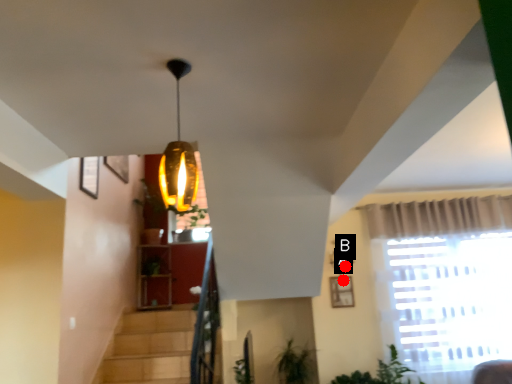
Question: Two points are circled on the image, labeled by A and B beside each circle. Which point is farther to the camera?

Choices:
 (A) A is further
 (B) B is further

Answer: (B)